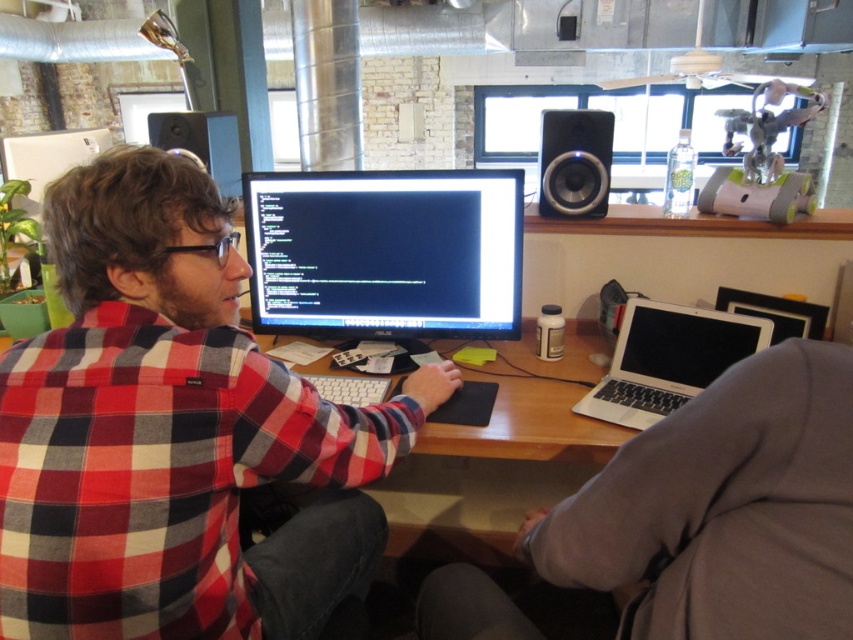
You are organizing a small event and need to place a 12 inch wide decorative item between the red plaid shirt at center and the gray fabric jacket at lower right on the desk. Will there be enough space?

The red plaid shirt at center is 16.18 inches from the gray fabric jacket at lower right. Since the decorative item is 12 inches wide, there is enough space to place it between them.